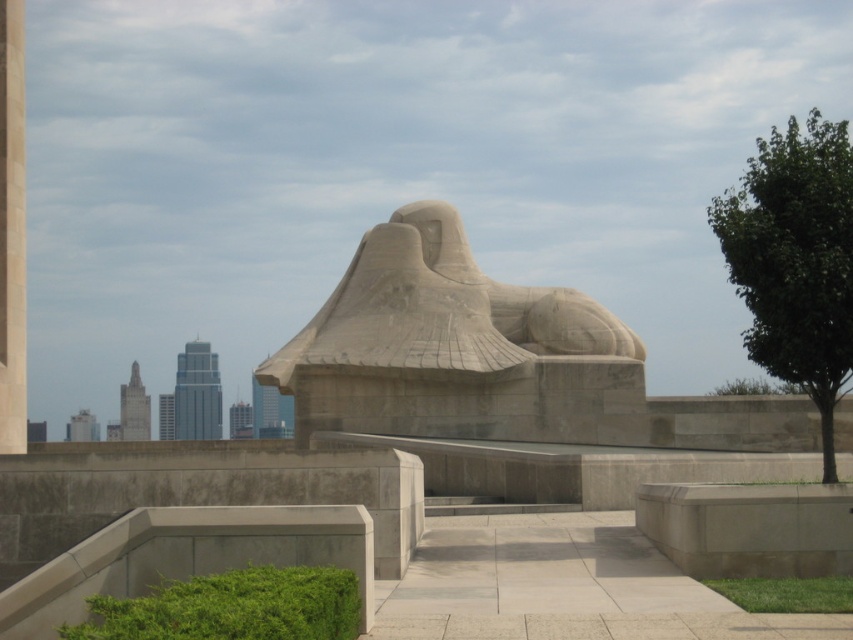
Is smooth stone sculpture at center shorter than smooth concrete pillar at left?

Yes, smooth stone sculpture at center is shorter than smooth concrete pillar at left.

Which is in front, point (457, 275) or point (0, 184)?

Point (0, 184)

Image resolution: width=853 pixels, height=640 pixels. Find the location of `smooth stone sculpture at center`. smooth stone sculpture at center is located at coordinates (456, 348).

Does green leafy tree at right come behind smooth concrete pillar at left?

No, it is not.

Is green leafy tree at right in front of smooth concrete pillar at left?

That is True.

Is point (792, 212) more distant than point (10, 237)?

That is False.

What are the coordinates of `green leafy tree at right` in the screenshot? It's located at (795, 260).

Which is more to the right, smooth stone sculpture at center or green leafy tree at right?

From the viewer's perspective, green leafy tree at right appears more on the right side.

Does smooth stone sculpture at center appear on the left side of green leafy tree at right?

Correct, you'll find smooth stone sculpture at center to the left of green leafy tree at right.

Describe the element at coordinates (456, 348) in the screenshot. This screenshot has height=640, width=853. I see `smooth stone sculpture at center` at that location.

Image resolution: width=853 pixels, height=640 pixels. I want to click on smooth stone sculpture at center, so click(x=456, y=348).